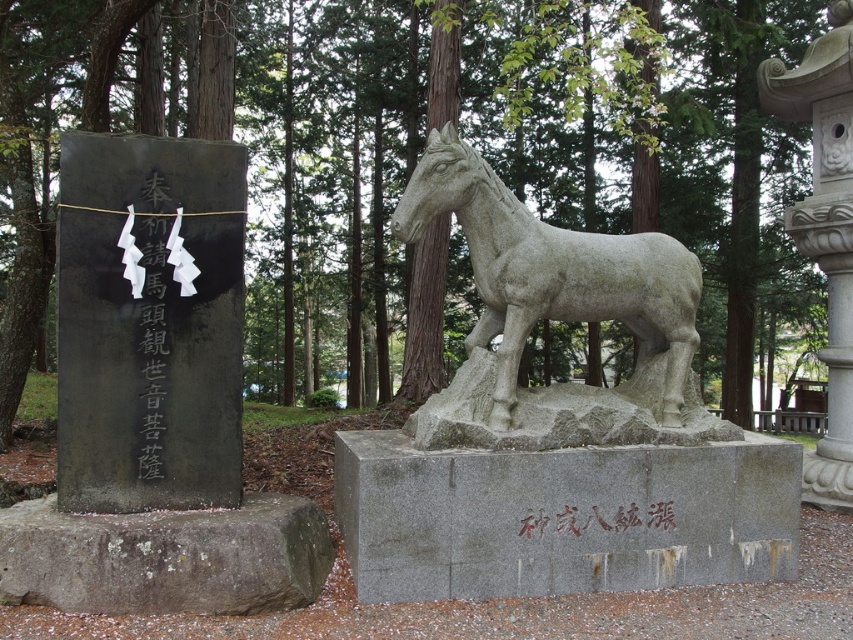
Is black stone monument at left smaller than white stone lantern at upper right?

No, black stone monument at left is not smaller than white stone lantern at upper right.

Can you confirm if black stone monument at left is thinner than white stone lantern at upper right?

No.

Is point (173, 161) closer to camera compared to point (849, 413)?

Yes, it is.

The width and height of the screenshot is (853, 640). In order to click on black stone monument at left in this screenshot , I will do `click(148, 324)`.

From the picture: Can you confirm if gray stone gravestone at center is taller than black stone monument at left?

No, gray stone gravestone at center is not taller than black stone monument at left.

Who is more distant from viewer, (343,483) or (73,376)?

Point (343,483)

This screenshot has width=853, height=640. Identify the location of gray stone gravestone at center. (561, 516).

Find the location of `gray stone gravestone at lower left`. gray stone gravestone at lower left is located at coordinates (165, 557).

Who is more forward, (x=294, y=554) or (x=161, y=296)?

Point (x=294, y=554) is in front.

You are a GUI agent. You are given a task and a screenshot of the screen. Output one action in this format:
    pyautogui.click(x=<x>, y=<y>)
    Task: Click on the gray stone gravestone at lower left
    
    Given the screenshot: What is the action you would take?
    pyautogui.click(x=165, y=557)